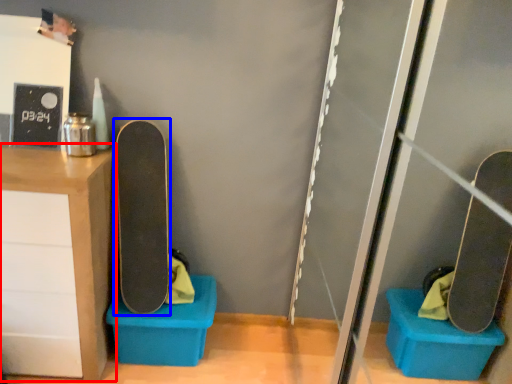
Question: Which of the following is the closest to the observer, furniture (highlighted by a red box) or skateboard (highlighted by a blue box)?

Choices:
 (A) furniture
 (B) skateboard

Answer: (A)